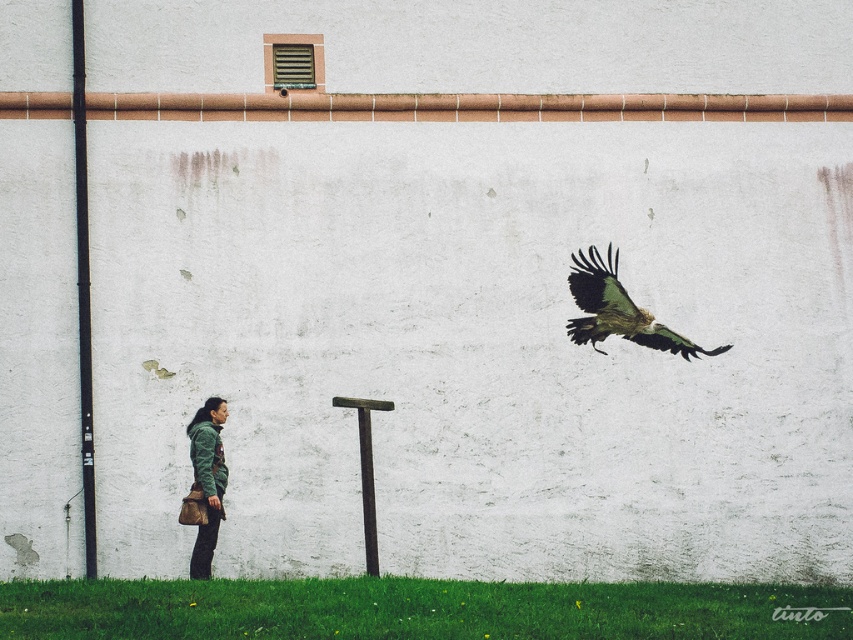
Looking at this image, you are an interior designer planning to hang a new artwork. You see the point marked at coordinate (618, 310). What object is located at that point?

The point at coordinate (618, 310) marks the greenish brown textured eagle at upper right.

You are an interior designer planning to install a new light fixture. You have two poles available for mounting the fixture. The black matte pole at left and the rusty metal pole at center. Which pole should you choose if you want the light fixture to be higher up?

The black matte pole at left has a greater height compared to the rusty metal pole at center, so you should choose the black matte pole at left to mount the light fixture if you want it higher up.